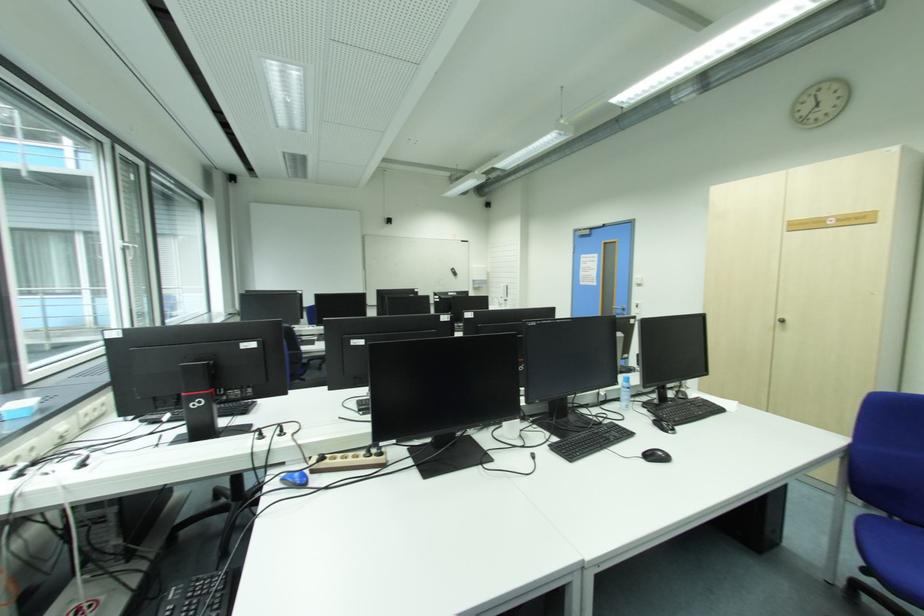
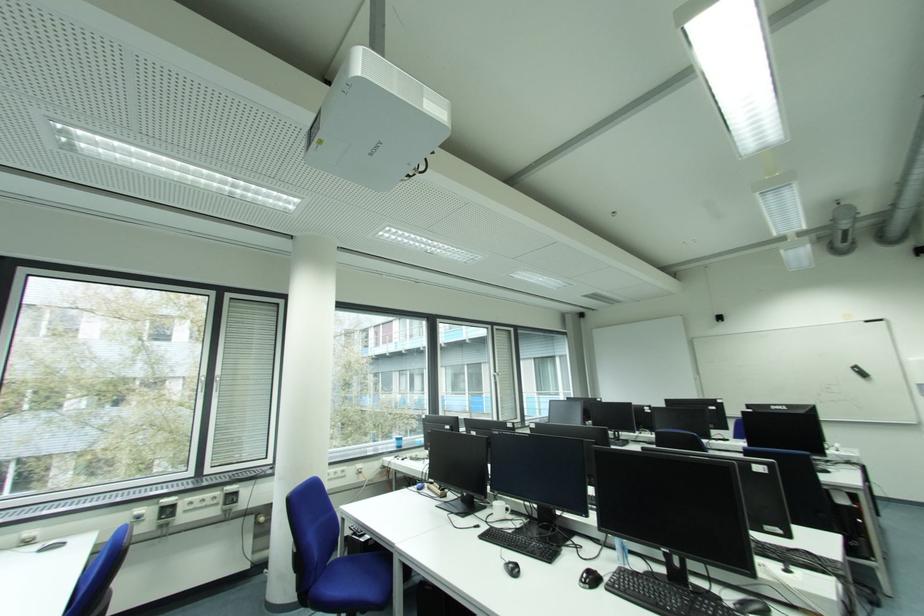
The point at (460,275) is marked in the first image. Where is the corresponding point in the second image?

(869, 376)